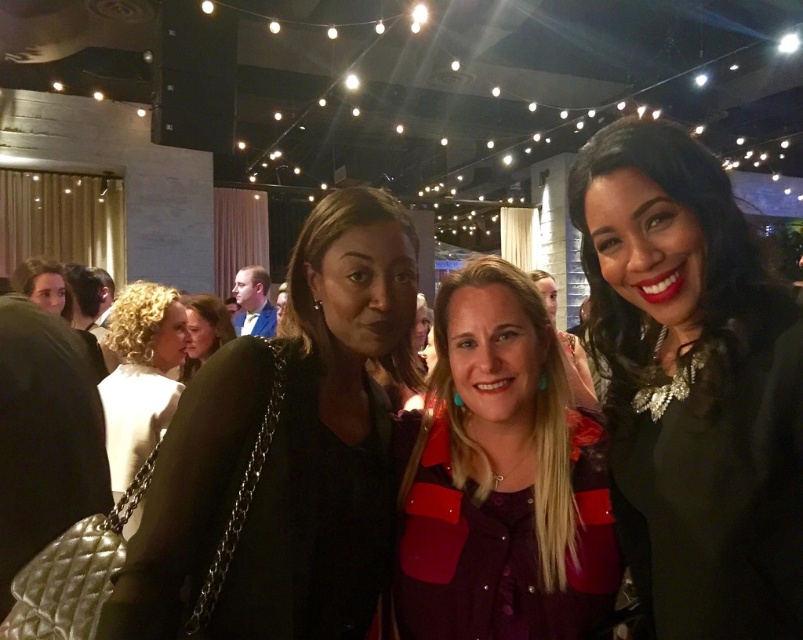
Does point (691, 452) come closer to viewer compared to point (243, 342)?

Yes, point (691, 452) is closer to viewer.

Between shiny black dress at center and black quilted purse at left, which one appears on the right side from the viewer's perspective?

Positioned to the right is shiny black dress at center.

This screenshot has width=803, height=640. Describe the element at coordinates (691, 385) in the screenshot. I see `shiny black dress at center` at that location.

Find the location of `shiny black dress at center`. shiny black dress at center is located at coordinates (691, 385).

Is black quilted purse at left to the left of white satin dress at left from the viewer's perspective?

No, black quilted purse at left is not to the left of white satin dress at left.

The height and width of the screenshot is (640, 803). What are the coordinates of `black quilted purse at left` in the screenshot? It's located at (284, 452).

Locate an element on the screen. This screenshot has width=803, height=640. black quilted purse at left is located at coordinates (284, 452).

Can you confirm if matte burgundy blouse at center is bigger than matte black jacket at center?

Indeed, matte burgundy blouse at center has a larger size compared to matte black jacket at center.

Does matte burgundy blouse at center appear on the right side of matte black jacket at center?

Correct, you'll find matte burgundy blouse at center to the right of matte black jacket at center.

Locate an element on the screen. matte burgundy blouse at center is located at coordinates (499, 480).